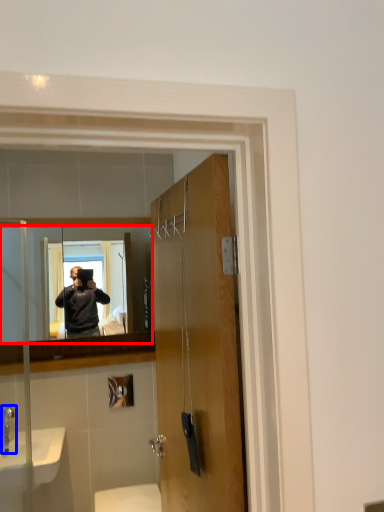
Question: Which point is further to the camera, mirror (highlighted by a red box) or faucet (highlighted by a blue box)?

Choices:
 (A) mirror
 (B) faucet

Answer: (A)